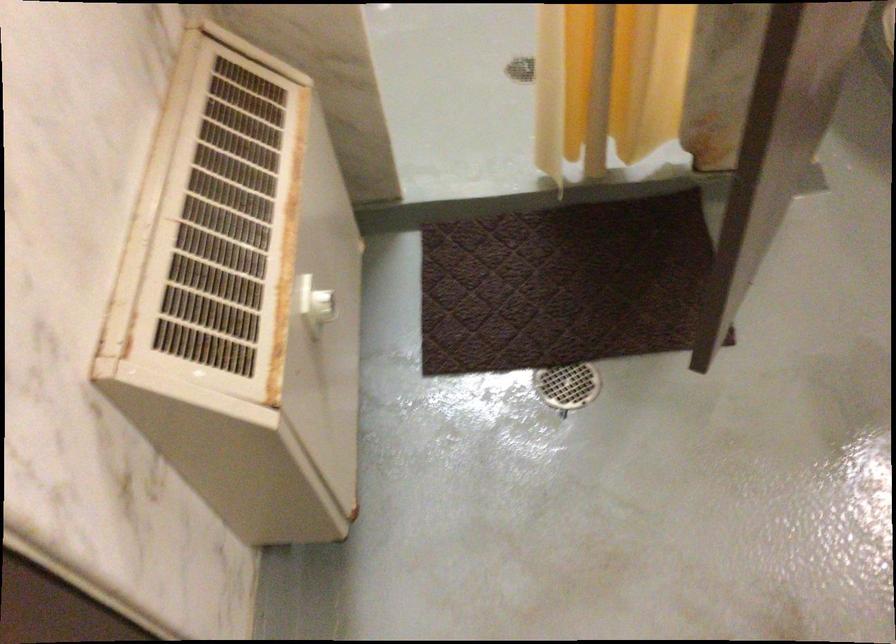
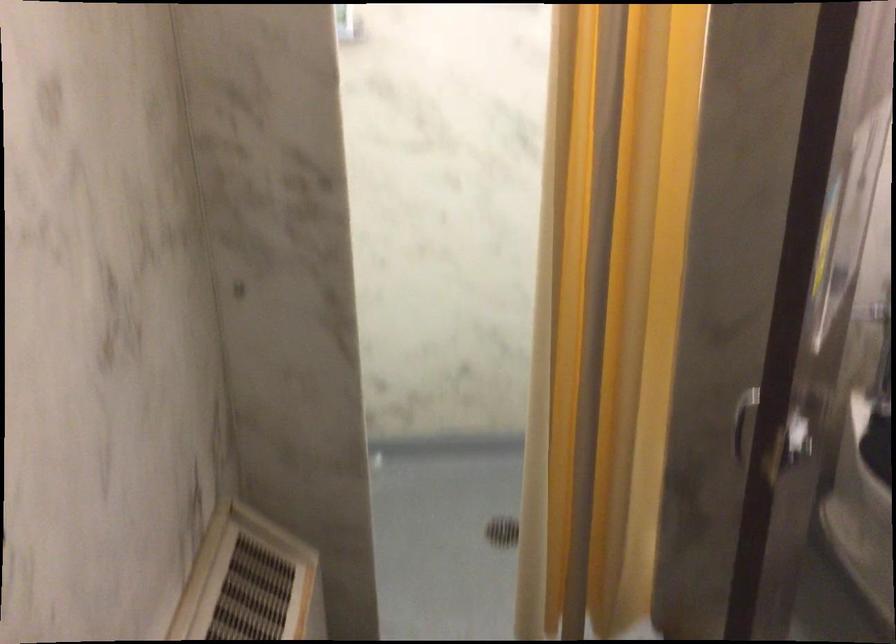
Which direction would the cameraman need to move to produce the second image?

The cameraman walked toward left, backward.